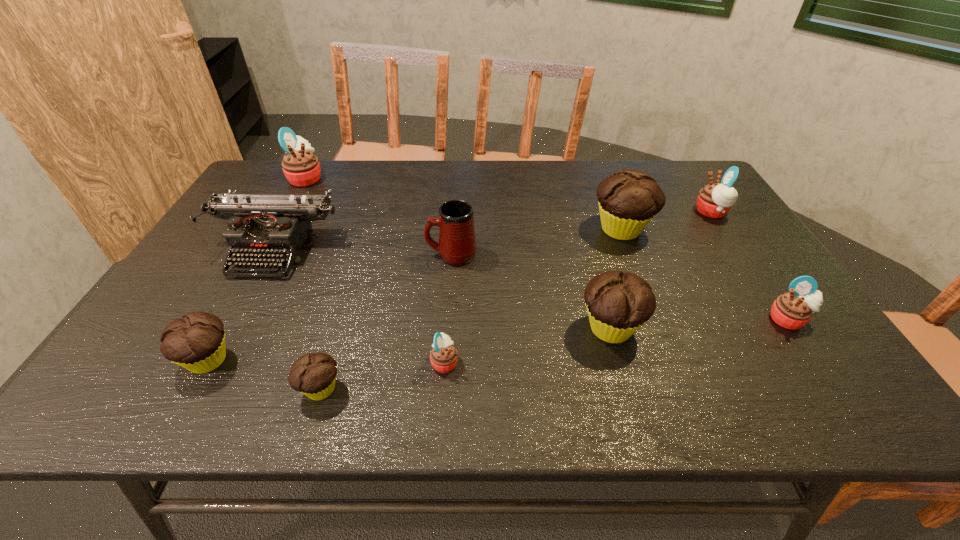
At what (x,y) coordinates should I click in order to perform the action: click on muffin that stands as the third closest to the mug. Please return your answer as a coordinate pair (x, y). This screenshot has width=960, height=540. Looking at the image, I should click on (628, 200).

This screenshot has height=540, width=960. Find the location of `pink muffin identified as the second closest to the third biggest pink muffin`. pink muffin identified as the second closest to the third biggest pink muffin is located at coordinates (443, 356).

Identify which pink muffin is the third closest to the sixth muffin from right to left. Please provide its 2D coordinates. Your answer should be formatted as a tuple, i.e. [(x, y)], where the tuple contains the x and y coordinates of a point satisfying the conditions above.

[(793, 310)]

Where is `chocolate muffin that stands as the third closest to the third biggest chocolate muffin`? chocolate muffin that stands as the third closest to the third biggest chocolate muffin is located at coordinates (628, 200).

In order to click on chocolate muffin identified as the third closest to the second chocolate muffin from left to right in this screenshot , I will do `click(628, 200)`.

You are a GUI agent. You are given a task and a screenshot of the screen. Output one action in this format:
    pyautogui.click(x=<x>, y=<y>)
    Task: Click on the vacant area in the image that satisfies the following two spatial constraints: 1. on the keyboard of the third muffin from left to right; 2. on the right side of the typewriter
    This screenshot has height=540, width=960.
    Given the screenshot: What is the action you would take?
    pyautogui.click(x=203, y=389)

The height and width of the screenshot is (540, 960). What are the coordinates of `vacant space that satisfies the following two spatial constraints: 1. on the keyboard of the typewriter; 2. on the right side of the fourth object from left to right` in the screenshot? It's located at (203, 389).